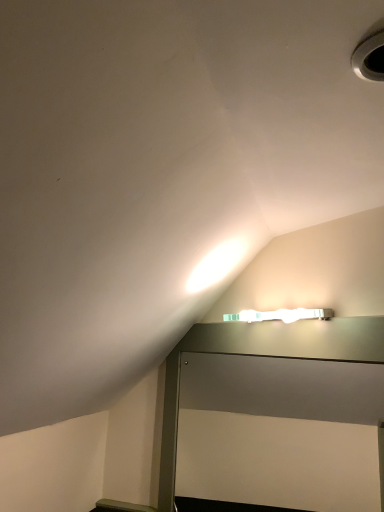
The width and height of the screenshot is (384, 512). What do you see at coordinates (264, 354) in the screenshot?
I see `metallic gray table at upper center` at bounding box center [264, 354].

Image resolution: width=384 pixels, height=512 pixels. I want to click on metallic gray table at upper center, so click(x=264, y=354).

Measure the distance between metallic gray table at upper center and camera.

metallic gray table at upper center and camera are 35.22 inches apart.

What do you see at coordinates (370, 58) in the screenshot? The height and width of the screenshot is (512, 384). I see `white plastic hole at upper right` at bounding box center [370, 58].

Where is `white plastic hole at upper right`? The width and height of the screenshot is (384, 512). white plastic hole at upper right is located at coordinates 370,58.

Measure the distance between white plastic hole at upper right and camera.

A distance of 18.22 inches exists between white plastic hole at upper right and camera.

The height and width of the screenshot is (512, 384). Identify the location of metallic gray table at upper center. (264, 354).

Is white plastic hole at upper right to the left or to the right of metallic gray table at upper center in the image?

white plastic hole at upper right is to the right of metallic gray table at upper center.

Does white plastic hole at upper right lie in front of metallic gray table at upper center?

Yes, white plastic hole at upper right is in front of metallic gray table at upper center.

Which point is more distant from viewer, (382, 37) or (191, 335)?

Positioned behind is point (191, 335).

Based on the photo, from the image's perspective, is white plastic hole at upper right located beneath metallic gray table at upper center?

No, from the image's perspective, white plastic hole at upper right is not beneath metallic gray table at upper center.

From a real-world perspective, between white plastic hole at upper right and metallic gray table at upper center, who is vertically higher?

In real-world perspective, white plastic hole at upper right is above.

Looking at their sizes, would you say white plastic hole at upper right is wider or thinner than metallic gray table at upper center?

Clearly, white plastic hole at upper right has more width compared to metallic gray table at upper center.

Between white plastic hole at upper right and metallic gray table at upper center, which one has less height?

With less height is white plastic hole at upper right.

Considering the relative sizes of white plastic hole at upper right and metallic gray table at upper center in the image provided, is white plastic hole at upper right bigger than metallic gray table at upper center?

No, white plastic hole at upper right is not bigger than metallic gray table at upper center.

Based on the photo, is metallic gray table at upper center completely or partially inside white plastic hole at upper right?

No, metallic gray table at upper center is not inside white plastic hole at upper right.

Is white plastic hole at upper right with metallic gray table at upper center?

No, white plastic hole at upper right is not making contact with metallic gray table at upper center.

Is white plastic hole at upper right facing towards metallic gray table at upper center?

No, white plastic hole at upper right is not oriented towards metallic gray table at upper center.

What's the angular difference between white plastic hole at upper right and metallic gray table at upper center's facing directions?

51.4 degrees separate the facing orientations of white plastic hole at upper right and metallic gray table at upper center.

The height and width of the screenshot is (512, 384). In the image, there is a white plastic hole at upper right. What are the coordinates of `table below it (from the image's perspective)` in the screenshot? It's located at (264, 354).

Is metallic gray table at upper center at the left side of white plastic hole at upper right?

Yes, metallic gray table at upper center is to the left of white plastic hole at upper right.

Which object is more forward, metallic gray table at upper center or white plastic hole at upper right?

white plastic hole at upper right is in front.

Is point (171, 412) positioned before point (382, 38)?

No, it is behind (382, 38).

From the image's perspective, is metallic gray table at upper center located beneath white plastic hole at upper right?

Yes.

From a real-world perspective, which is physically below, metallic gray table at upper center or white plastic hole at upper right?

In real-world perspective, metallic gray table at upper center is lower.

Which of these two, metallic gray table at upper center or white plastic hole at upper right, is wider?

Wider between the two is white plastic hole at upper right.

Which of these two, metallic gray table at upper center or white plastic hole at upper right, stands shorter?

Standing shorter between the two is white plastic hole at upper right.

Considering the sizes of objects metallic gray table at upper center and white plastic hole at upper right in the image provided, who is bigger, metallic gray table at upper center or white plastic hole at upper right?

metallic gray table at upper center.

Is metallic gray table at upper center spatially inside white plastic hole at upper right, or outside of it?

The correct answer is: outside.

Is metallic gray table at upper center touching white plastic hole at upper right?

No.

Is metallic gray table at upper center positioned with its back to white plastic hole at upper right?

metallic gray table at upper center does not have its back to white plastic hole at upper right.

Can you tell me how much metallic gray table at upper center and white plastic hole at upper right differ in facing direction?

The facing directions of metallic gray table at upper center and white plastic hole at upper right are 51.4 degrees apart.

Identify the location of hole lying on the right of metallic gray table at upper center. (370, 58).

Find the location of `hole above the metallic gray table at upper center (from a real-world perspective)`. hole above the metallic gray table at upper center (from a real-world perspective) is located at coordinates pos(370,58).

The width and height of the screenshot is (384, 512). Find the location of `table below the white plastic hole at upper right (from a real-world perspective)`. table below the white plastic hole at upper right (from a real-world perspective) is located at coordinates (264, 354).